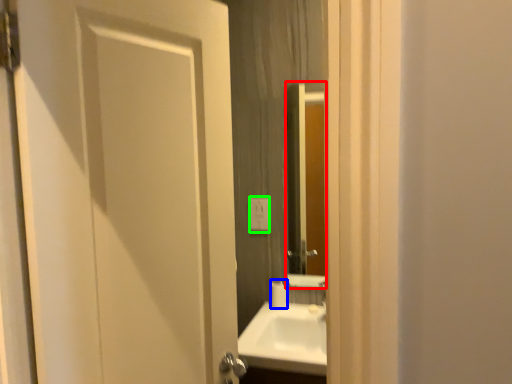
Question: Estimate the real-world distances between objects in this image. Which object is closer to mirror (highlighted by a red box), toilet paper (highlighted by a blue box) or electric outlet (highlighted by a green box)?

Choices:
 (A) toilet paper
 (B) electric outlet

Answer: (B)